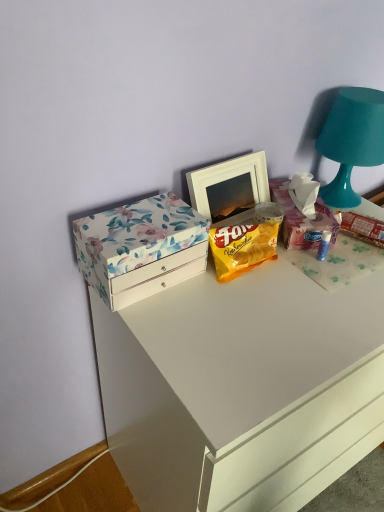
Where is `vacant space in front of white matte picture frame at center`? The image size is (384, 512). vacant space in front of white matte picture frame at center is located at coordinates (261, 286).